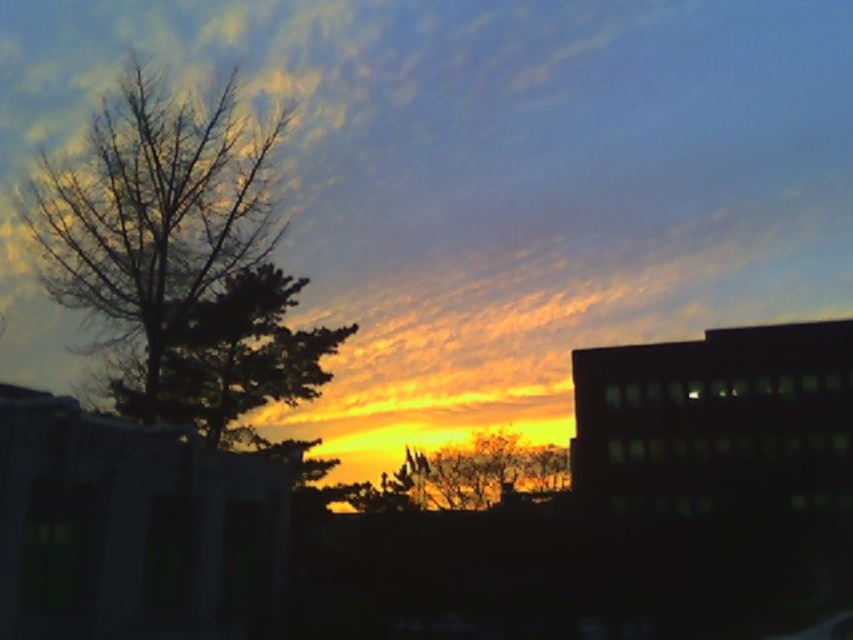
Question: Is cloudy sky at center to the left of green leafy tree at upper left from the viewer's perspective?

Choices:
 (A) no
 (B) yes

Answer: (A)

Question: Does bare branches at left appear on the left side of green leafy tree at upper left?

Choices:
 (A) no
 (B) yes

Answer: (B)

Question: From the image, what is the correct spatial relationship of cloudy sky at center in relation to bare branches at left?

Choices:
 (A) below
 (B) above

Answer: (B)

Question: Which point is closer to the camera?

Choices:
 (A) bare branches at left
 (B) green leafy tree at upper left

Answer: (B)

Question: Which object is farther from the camera taking this photo?

Choices:
 (A) bare branches at left
 (B) cloudy sky at center

Answer: (B)

Question: Which object is positioned farthest from the green leafy tree at upper left?

Choices:
 (A) bare branches at left
 (B) cloudy sky at center

Answer: (B)